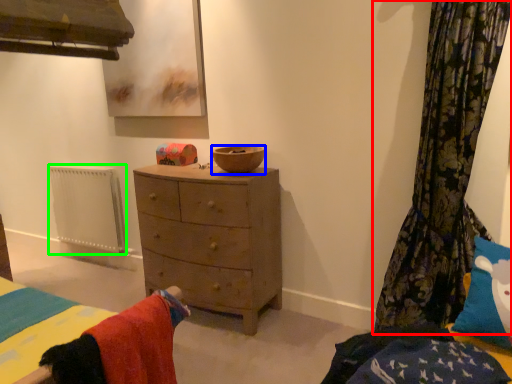
Question: Which object is the farthest from curtain (highlighted by a red box)? Choose among these: bowl (highlighted by a blue box) or radiator (highlighted by a green box).

Choices:
 (A) bowl
 (B) radiator

Answer: (B)